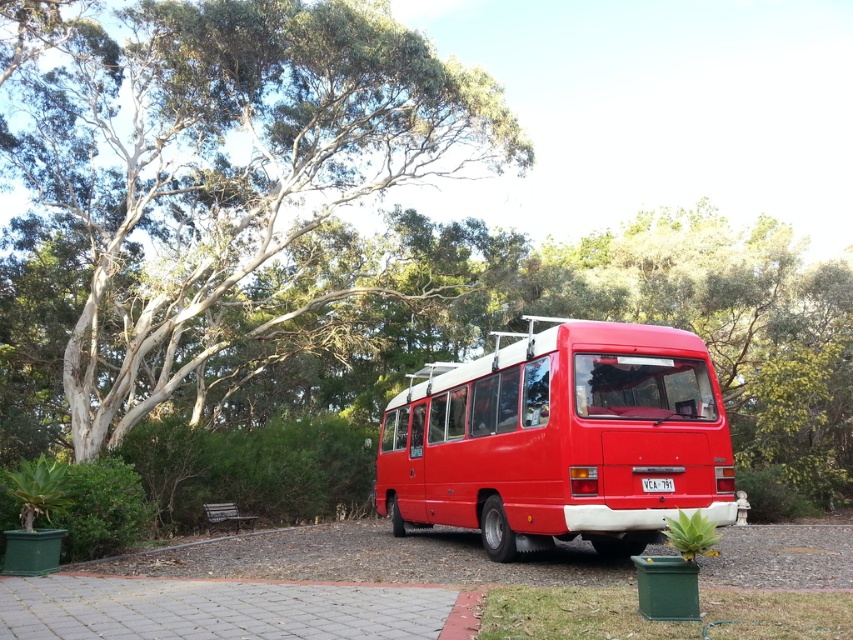
Does point (416, 179) come behind point (469, 484)?

Yes.

Who is taller, smooth bark tree at upper left or shiny red bus at center?

With more height is smooth bark tree at upper left.

Which is behind, point (257, 19) or point (657, 387)?

The point (257, 19) is behind.

Where is `smooth bark tree at upper left`? This screenshot has height=640, width=853. smooth bark tree at upper left is located at coordinates (234, 179).